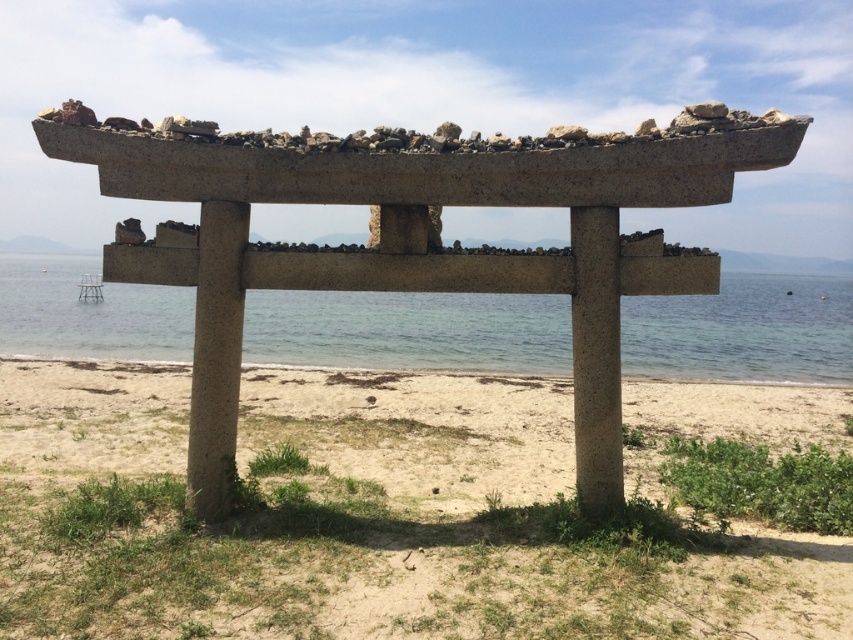
You are planning to build a small sandcastle on the light brown sandy beach at center. Considering the size of the beach, will there be enough space to construct it without encroaching on the clear blue water at center?

The light brown sandy beach at center has a smaller size compared to clear blue water at center, so there might not be enough space to build a sandcastle without getting too close to the water.

You are standing at the coordinates given for the light brown sandy beach at center. If you walk straight ahead, will you eventually reach the sea?

Yes, since the light brown sandy beach at center stretches towards the calm sea in the background, walking straight ahead would lead you to the sea.